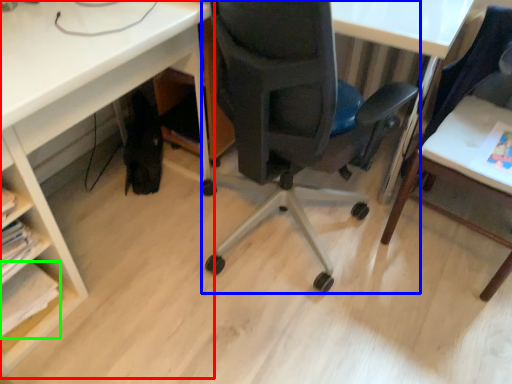
Question: Which object is positioned closest to desk (highlighted by a red box)? Select from chair (highlighted by a blue box) and book (highlighted by a green box).

Choices:
 (A) chair
 (B) book

Answer: (A)